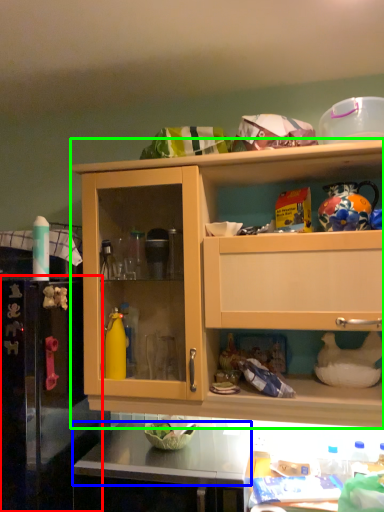
Question: Considering the real-world distances, which object is farthest from appliance (highlighted by a red box)? counter top (highlighted by a blue box) or cabinetry (highlighted by a green box)?

Choices:
 (A) counter top
 (B) cabinetry

Answer: (B)